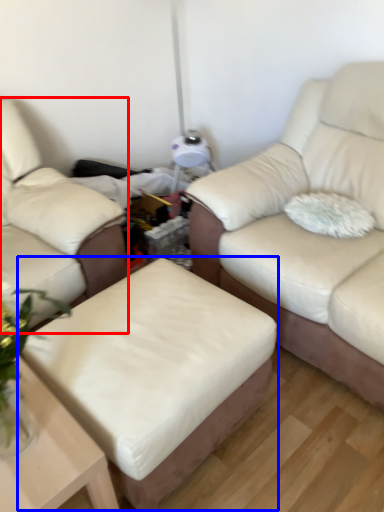
Question: Which object appears farthest to the camera in this image, studio couch (highlighted by a red box) or stool (highlighted by a blue box)?

Choices:
 (A) studio couch
 (B) stool

Answer: (A)